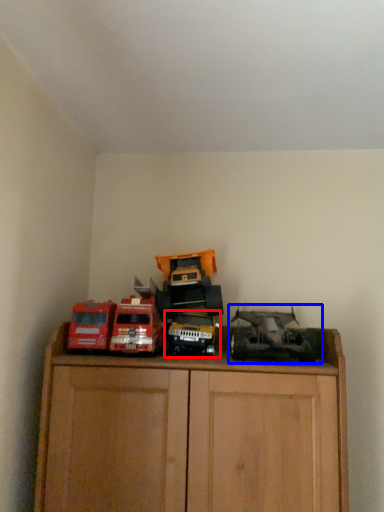
Question: Which of the following is the farthest to the observer, toy (highlighted by a red box) or toy (highlighted by a blue box)?

Choices:
 (A) toy
 (B) toy

Answer: (A)